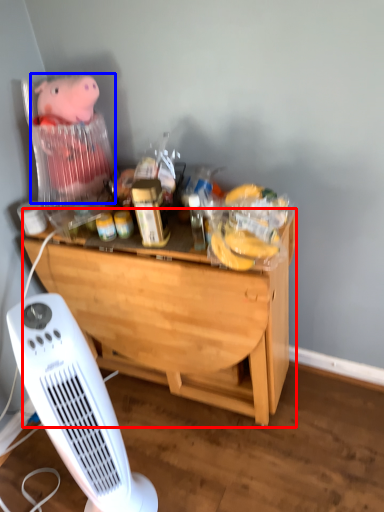
Question: Among these objects, which one is farthest to the camera, desk (highlighted by a red box) or toy (highlighted by a blue box)?

Choices:
 (A) desk
 (B) toy

Answer: (B)